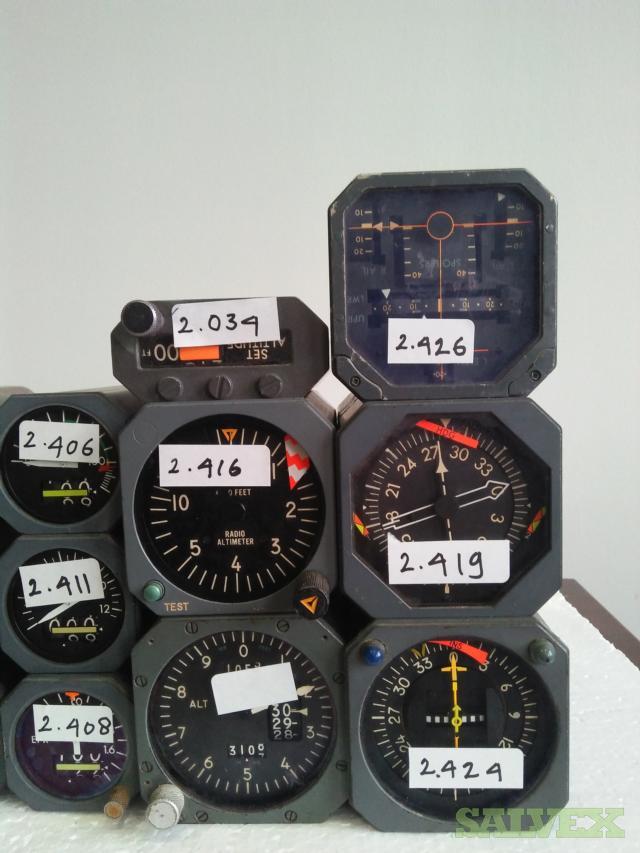
This screenshot has height=853, width=640. Identify the location of white placemat. (605, 716).